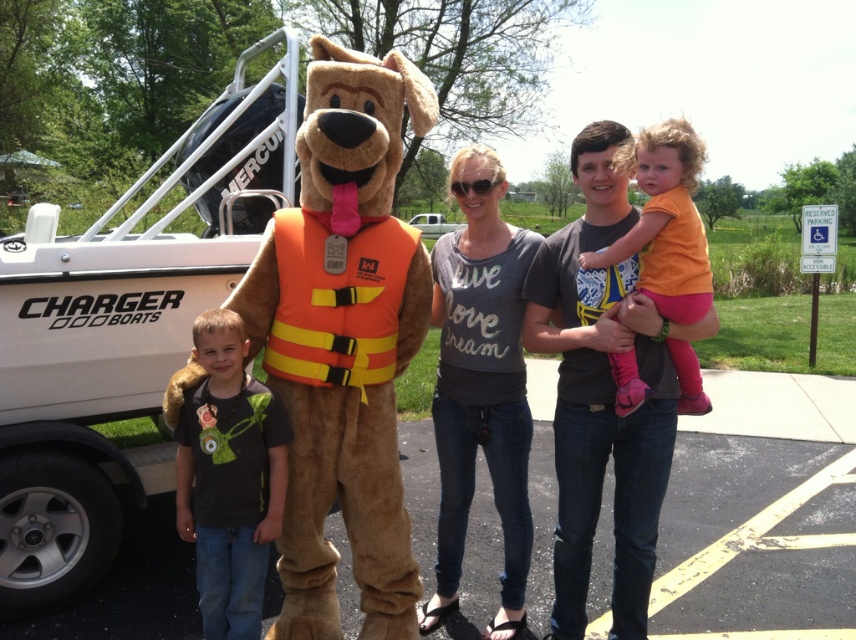
Question: Which is farther from the black matte t-shirt at center?

Choices:
 (A) orange/yellow fabric life jacket at center
 (B) orange cotton shirt at upper center

Answer: (B)

Question: Among these points, which one is nearest to the camera?

Choices:
 (A) (675, 189)
 (B) (575, 317)
 (C) (358, 326)

Answer: (A)

Question: Which of the following is the farthest from the observer?

Choices:
 (A) fuzzy brown mascot at left
 (B) orange cotton shirt at upper center

Answer: (B)

Question: Can you confirm if dark gray t-shirt at center is smaller than orange cotton shirt at upper center?

Choices:
 (A) no
 (B) yes

Answer: (A)

Question: Does dark gray t-shirt at center have a larger size compared to orange cotton shirt at upper center?

Choices:
 (A) yes
 (B) no

Answer: (A)

Question: Can you confirm if black matte t-shirt at center is positioned to the right of orange/yellow fabric life jacket at center?

Choices:
 (A) yes
 (B) no

Answer: (B)